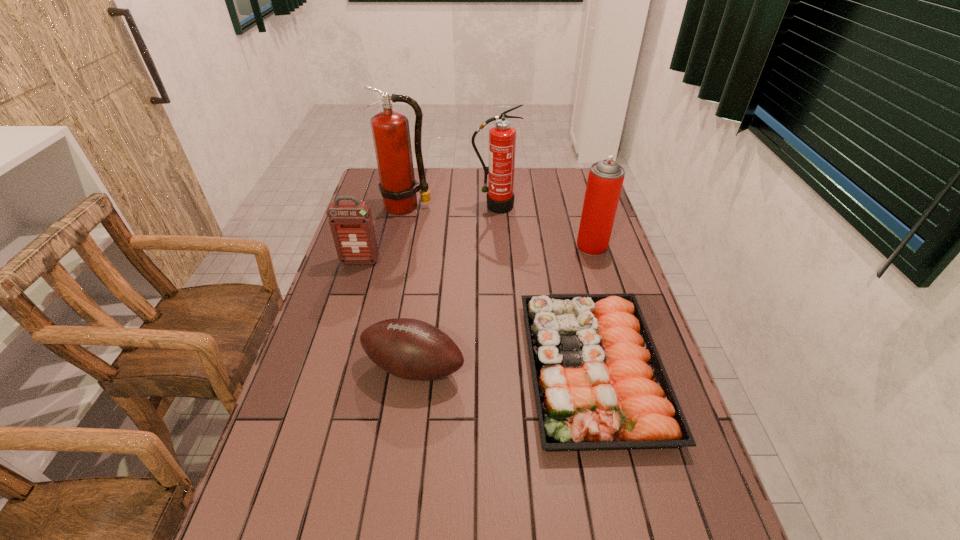
Locate an element on the screen. This screenshot has width=960, height=540. vacant region located on the back of the aerosol can is located at coordinates (581, 210).

At what (x,y) coordinates should I click in order to perform the action: click on vacant space situated 0.050m on the front-facing side of the third shortest object. Please return your answer as a coordinate pair (x, y). The width and height of the screenshot is (960, 540). Looking at the image, I should click on (355, 275).

Locate an element on the screen. free space located 0.250m on the right of the second shortest object is located at coordinates (563, 367).

Find the location of a particular element. vacant space situated on the left of the platter is located at coordinates (425, 369).

Identify the location of object located at the far edge. (390, 129).

Image resolution: width=960 pixels, height=540 pixels. Identify the location of fire extinguisher at the left edge. (390, 129).

I want to click on the first-aid kit present at the left edge, so click(351, 223).

At what (x,y) coordinates should I click in order to perform the action: click on football (American) that is at the left edge. Please return your answer as a coordinate pair (x, y). Looking at the image, I should click on (411, 349).

The height and width of the screenshot is (540, 960). In order to click on aerosol can present at the right edge in this screenshot , I will do `click(605, 180)`.

You are a GUI agent. You are given a task and a screenshot of the screen. Output one action in this format:
    pyautogui.click(x=<x>, y=<y>)
    Task: Click on the platter positioned at the right edge
    The height and width of the screenshot is (540, 960).
    Given the screenshot: What is the action you would take?
    pyautogui.click(x=599, y=382)